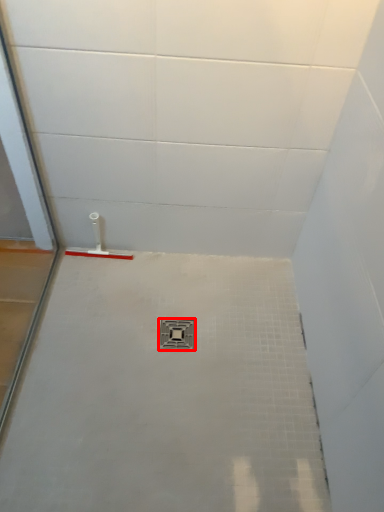
Question: From the image's perspective, where is plumbing fixture (annotated by the red box) located in relation to shower in the image?

Choices:
 (A) above
 (B) below

Answer: (B)